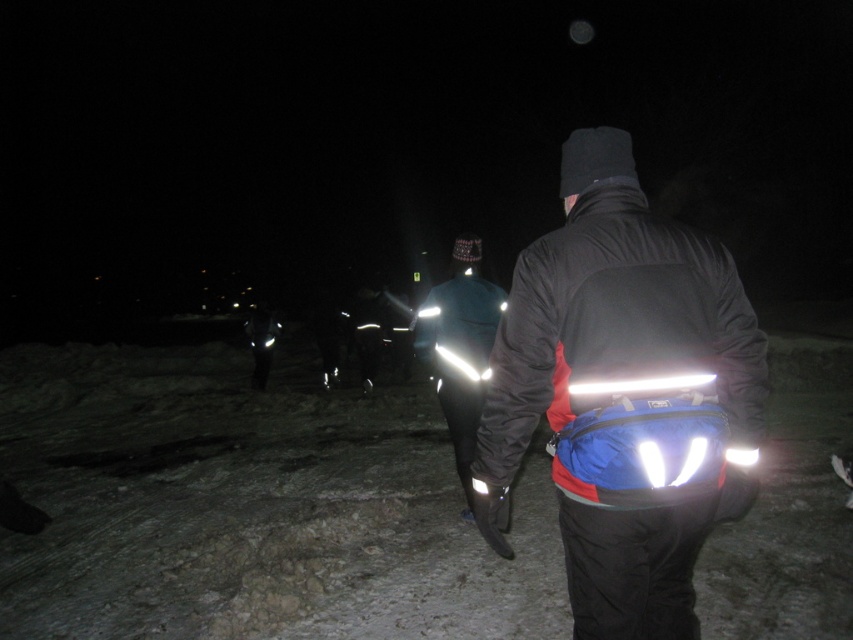
You are standing at the camera position and want to move towards the two points in the image. Which point, point (648, 237) or point (444, 376), will you reach first?

Point (648, 237) is closer to the camera than point (444, 376), so you will reach point (648, 237) first.

You are a hiker trying to follow the group in the dark. You see two jackets at the center of the scene, a reflective fabric jacket at center and a glossy reflective jacket at center. Which one is positioned to the left?

The reflective fabric jacket at center is positioned to the left of the glossy reflective jacket at center.